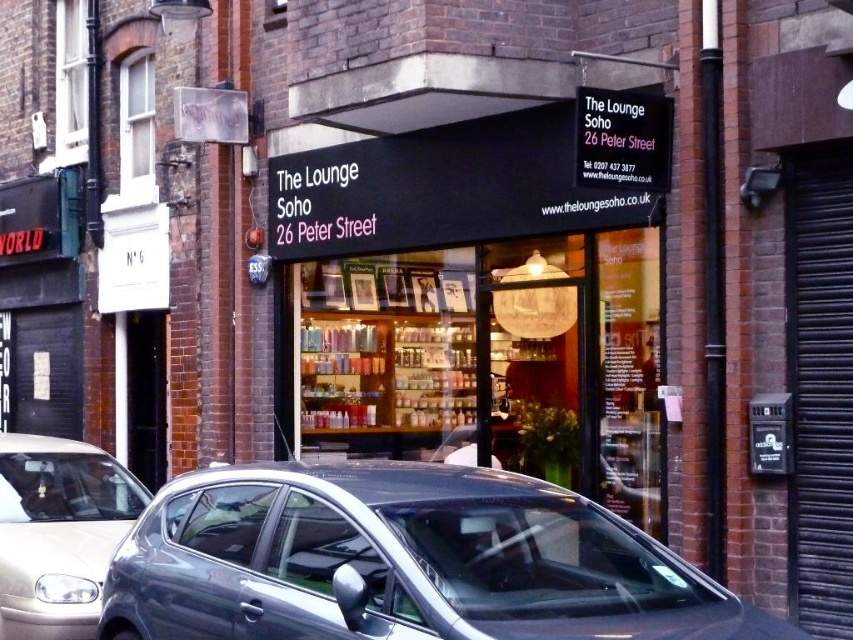
Question: Among these objects, which one is farthest from the camera?

Choices:
 (A) silver metallic car at lower left
 (B) metallic gray hatchback at lower left

Answer: (A)

Question: Where is metallic gray hatchback at lower left located in relation to silver metallic car at lower left in the image?

Choices:
 (A) above
 (B) below

Answer: (A)

Question: Can you confirm if metallic gray hatchback at lower left is thinner than silver metallic car at lower left?

Choices:
 (A) yes
 (B) no

Answer: (B)

Question: In this image, where is metallic gray hatchback at lower left located relative to silver metallic car at lower left?

Choices:
 (A) below
 (B) above

Answer: (B)